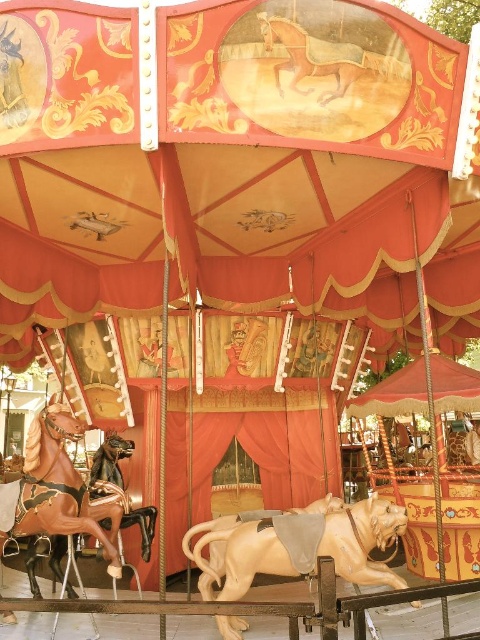
Can you confirm if golden polished wood horse at upper center is positioned above light beige wood horse at center?

Indeed, golden polished wood horse at upper center is positioned over light beige wood horse at center.

Between golden polished wood horse at upper center and light beige wood horse at center, which one appears on the right side from the viewer's perspective?

golden polished wood horse at upper center

Identify the location of golden polished wood horse at upper center. The image size is (480, 640). (326, 60).

Find the location of `golden polished wood horse at upper center`. golden polished wood horse at upper center is located at coordinates (326, 60).

Does shiny brown horse at left have a greater width compared to golden polished wood horse at upper center?

Yes.

Between shiny brown horse at left and golden polished wood horse at upper center, which one is positioned lower?

shiny brown horse at left is lower down.

Measure the distance between point (1, 513) and camera.

Point (1, 513) is 4.72 meters from camera.

You are a GUI agent. You are given a task and a screenshot of the screen. Output one action in this format:
    pyautogui.click(x=<x>, y=<y>)
    Task: Click on the shiny brown horse at left
    
    Given the screenshot: What is the action you would take?
    pyautogui.click(x=56, y=488)

Based on the photo, who is shorter, light brown polished wood horse at center or shiny brown horse at left?

With less height is light brown polished wood horse at center.

Between point (242, 531) and point (10, 616), which one is positioned in front?

Point (242, 531)

Is point (382, 529) less distant than point (43, 410)?

Yes, it is.

Where is `light brown polished wood horse at center`? light brown polished wood horse at center is located at coordinates pos(362,540).